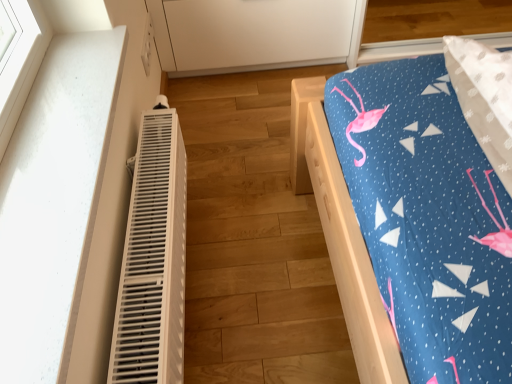
Question: Is white plastic heater at left spatially inside wooden bed at right, or outside of it?

Choices:
 (A) outside
 (B) inside

Answer: (A)

Question: Looking at the image, does white plastic heater at left seem bigger or smaller compared to wooden bed at right?

Choices:
 (A) small
 (B) big

Answer: (A)

Question: Estimate the real-world distances between objects in this image. Which object is closer to the white plastic heater at left?

Choices:
 (A) wooden bed at right
 (B) white matte cabinet at upper center

Answer: (A)

Question: Estimate the real-world distances between objects in this image. Which object is farther from the white matte cabinet at upper center?

Choices:
 (A) wooden bed at right
 (B) white plastic heater at left

Answer: (A)